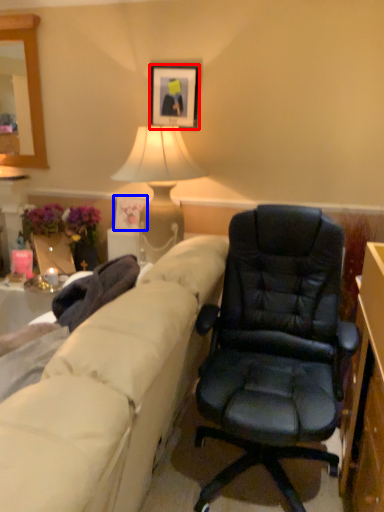
Question: Among these objects, which one is nearest to the camera, picture frame (highlighted by a red box) or picture frame (highlighted by a blue box)?

Choices:
 (A) picture frame
 (B) picture frame

Answer: (A)